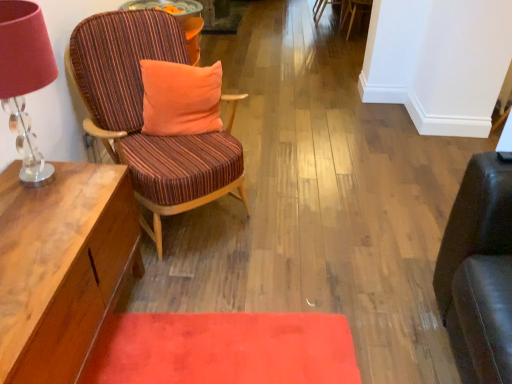
Question: Can you confirm if orange velvety pillow at center is smaller than striped fabric chair at left, the third chair viewed from the right?

Choices:
 (A) no
 (B) yes

Answer: (B)

Question: From the image's perspective, does orange velvety pillow at center appear lower than striped fabric chair at left, the third chair when ordered from back to front?

Choices:
 (A) no
 (B) yes

Answer: (A)

Question: Does orange velvety pillow at center lie behind striped fabric chair at left, arranged as the 1th chair when viewed from the front?

Choices:
 (A) no
 (B) yes

Answer: (B)

Question: Is orange velvety pillow at center oriented towards striped fabric chair at left, which is the first chair from bottom to top?

Choices:
 (A) yes
 (B) no

Answer: (A)

Question: Considering the relative sizes of orange velvety pillow at center and striped fabric chair at left, the 3th chair in the top-to-bottom sequence, in the image provided, is orange velvety pillow at center thinner than striped fabric chair at left, the 3th chair in the top-to-bottom sequence,?

Choices:
 (A) no
 (B) yes

Answer: (B)

Question: Is point (320, 13) closer or farther from the camera than point (10, 89)?

Choices:
 (A) closer
 (B) farther

Answer: (B)

Question: From their relative heights in the image, would you say wooden chair with striped upholstery at center, placed as the 2th chair when sorted from right to left, is taller or shorter than translucent glass table lamp at left?

Choices:
 (A) tall
 (B) short

Answer: (B)

Question: Is wooden chair with striped upholstery at center, placed as the 2th chair when sorted from right to left, to the left or to the right of translucent glass table lamp at left in the image?

Choices:
 (A) right
 (B) left

Answer: (A)

Question: Is wooden chair with striped upholstery at center, which is the first chair from top to bottom, in front of or behind translucent glass table lamp at left in the image?

Choices:
 (A) front
 (B) behind

Answer: (B)

Question: Is translucent glass table lamp at left bigger or smaller than wooden chair with striped upholstery at center, the third chair positioned from the bottom?

Choices:
 (A) small
 (B) big

Answer: (A)

Question: In terms of height, does translucent glass table lamp at left look taller or shorter compared to wooden chair with striped upholstery at center, the third chair positioned from the bottom?

Choices:
 (A) short
 (B) tall

Answer: (B)

Question: From the image's perspective, is translucent glass table lamp at left above or below wooden chair with striped upholstery at center, placed as the 2th chair when sorted from right to left?

Choices:
 (A) above
 (B) below

Answer: (B)

Question: From a real-world perspective, is translucent glass table lamp at left physically located above or below wooden chair with striped upholstery at center, acting as the 1th chair starting from the back?

Choices:
 (A) below
 (B) above

Answer: (B)

Question: Is velvety red mat at lower center spatially inside translucent glass table lamp at left, or outside of it?

Choices:
 (A) outside
 (B) inside

Answer: (A)

Question: Is point (159, 345) positioned closer to the camera than point (2, 49)?

Choices:
 (A) closer
 (B) farther

Answer: (B)